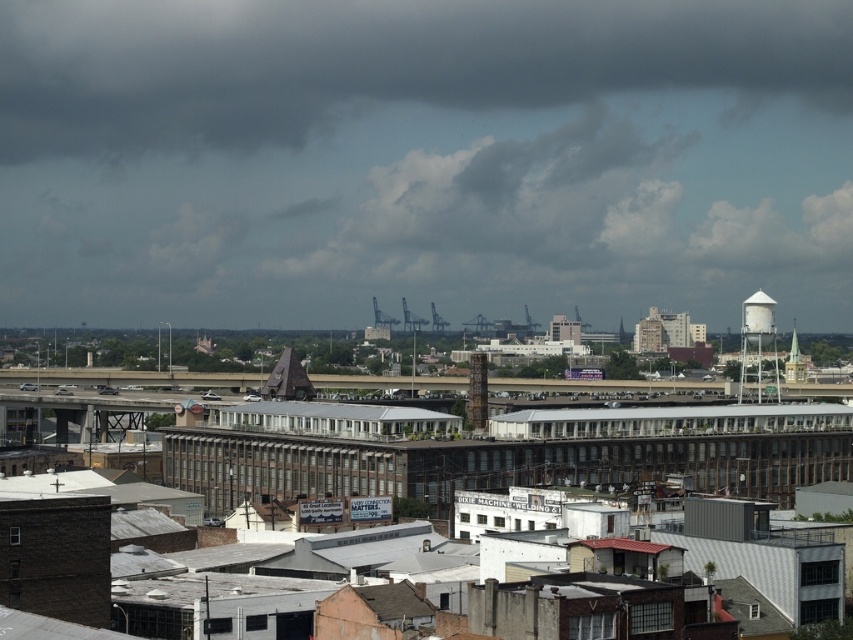
You are a weather drone tasked with measuring the position of clouds in the sky. You observe the dark gray cloud at upper center in the image. What are its coordinates?

The dark gray cloud at upper center is located at point (376,64).

You are standing in the middle of the highway looking towards the urban landscape. You see the dark gray cloud at upper center and the white matte water tower at upper right. Which one is positioned to the left when facing the scene?

The dark gray cloud at upper center is positioned to the left of the white matte water tower at upper right.